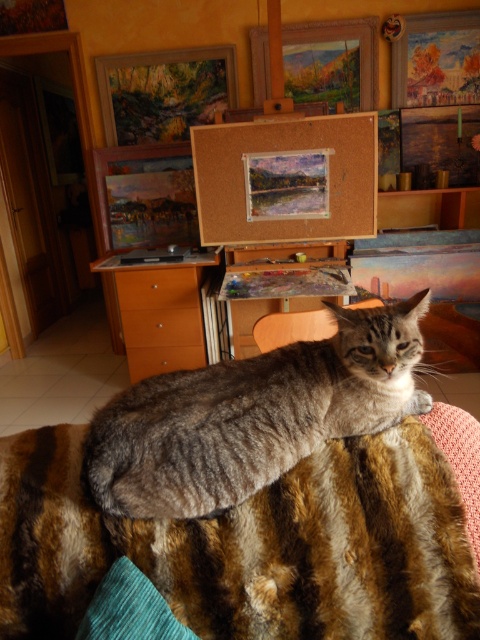
Which is below, striped fur blanket at center or gray striped fur cat at center?

striped fur blanket at center

Can you confirm if striped fur blanket at center is positioned to the left of gray striped fur cat at center?

Yes, striped fur blanket at center is to the left of gray striped fur cat at center.

Who is more distant from viewer, (280, 528) or (360, 401)?

The point (360, 401) is behind.

The image size is (480, 640). I want to click on striped fur blanket at center, so click(x=251, y=547).

Does gray striped fur cat at center have a smaller size compared to corkboard at center?

Indeed, gray striped fur cat at center has a smaller size compared to corkboard at center.

Does gray striped fur cat at center appear under corkboard at center?

Yes.

Where is `gray striped fur cat at center`? The image size is (480, 640). gray striped fur cat at center is located at coordinates (252, 416).

Who is more distant from viewer, (418, 628) or (297, 132)?

The point (297, 132) is more distant.

Does striped fur blanket at center have a lesser width compared to corkboard at center?

Yes.

Does point (360, 632) come in front of point (232, 236)?

Yes.

Identify the location of striped fur blanket at center. This screenshot has width=480, height=640. (251, 547).